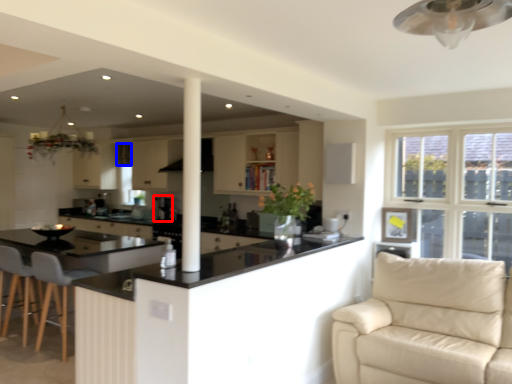
Question: Which object appears closest to the camera in this image, coffee machine (highlighted by a red box) or curtain (highlighted by a blue box)?

Choices:
 (A) coffee machine
 (B) curtain

Answer: (A)